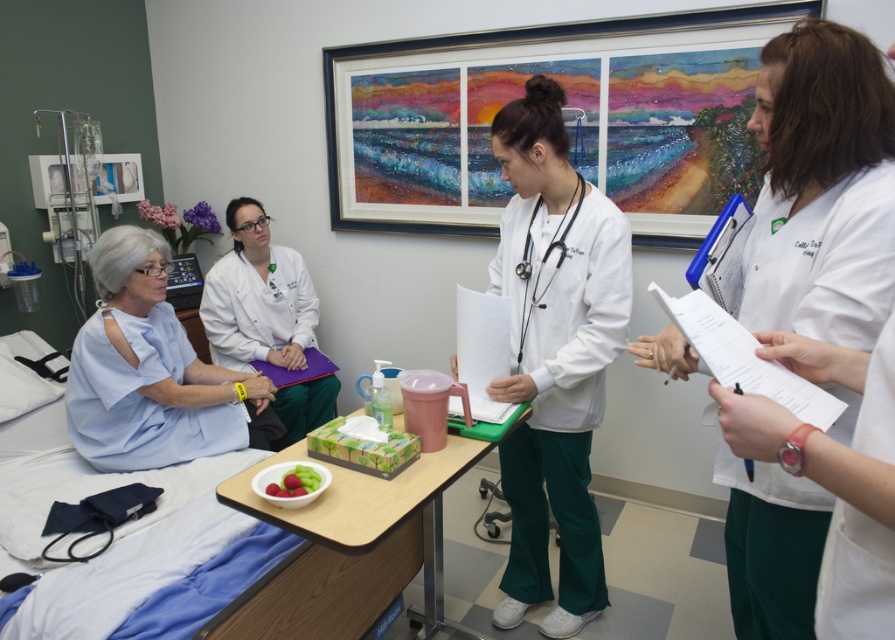
Question: Which of the following is the farthest from the observer?

Choices:
 (A) white matte lab coat at center
 (B) white smooth uniform at center
 (C) white smooth paper at center

Answer: (A)

Question: Considering the relative positions of white smooth uniform at center and light blue fabric at left in the image provided, where is white smooth uniform at center located with respect to light blue fabric at left?

Choices:
 (A) above
 (B) below

Answer: (B)

Question: Can you confirm if light blue fabric at left is thinner than smooth plastic bowl at center?

Choices:
 (A) yes
 (B) no

Answer: (B)

Question: Which of the following is the farthest from the observer?

Choices:
 (A) white matte lab coat at center
 (B) blue fabric hospital bed at left
 (C) white smooth uniform at center
 (D) light blue fabric at left

Answer: (A)

Question: Is white smooth paper at center to the left of smooth plastic bowl at center from the viewer's perspective?

Choices:
 (A) yes
 (B) no

Answer: (B)

Question: Which object is farther from the camera taking this photo?

Choices:
 (A) white matte lab coat at center
 (B) white smooth paper at center

Answer: (A)